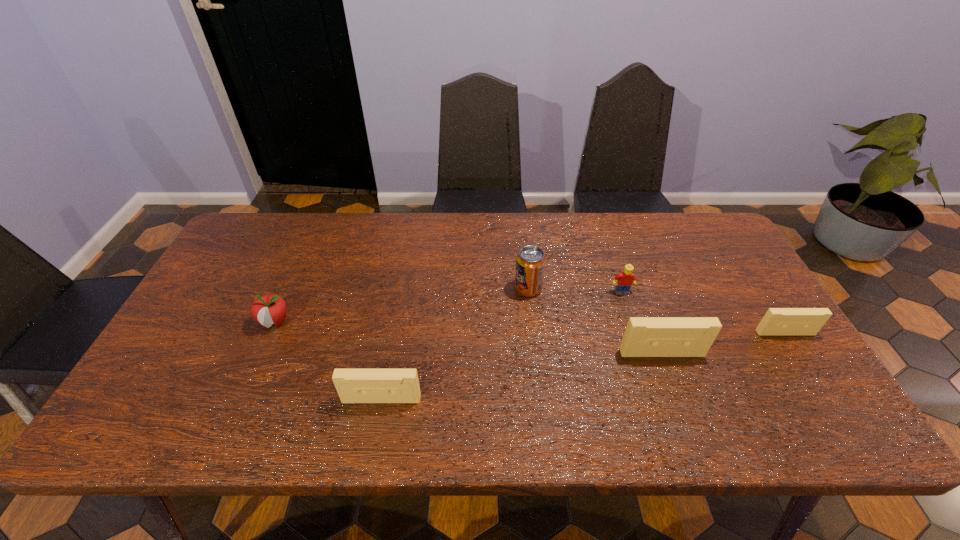
Image resolution: width=960 pixels, height=540 pixels. Identify the location of location for an additional videotape to make spacing equal. (528, 375).